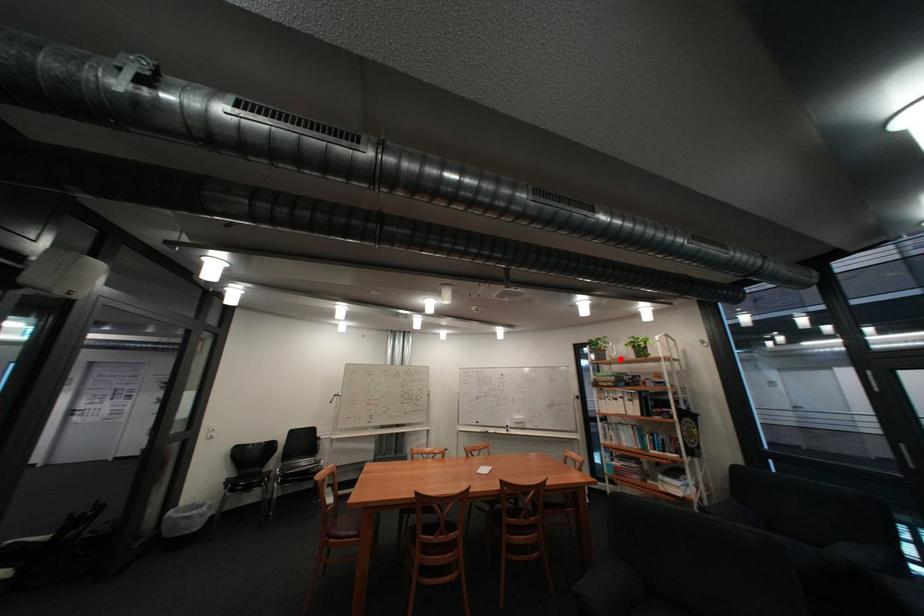
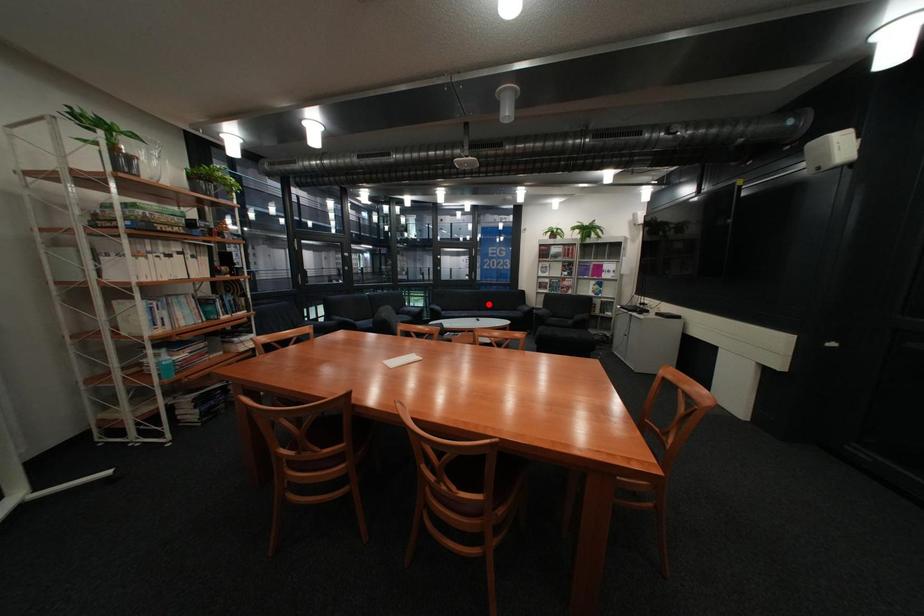
I am providing you with two images of the same scene from different viewpoints. A red point is marked on the first image and another point is marked on the second image. Does the point marked in image1 correspond to the same location as the one in image2?

No